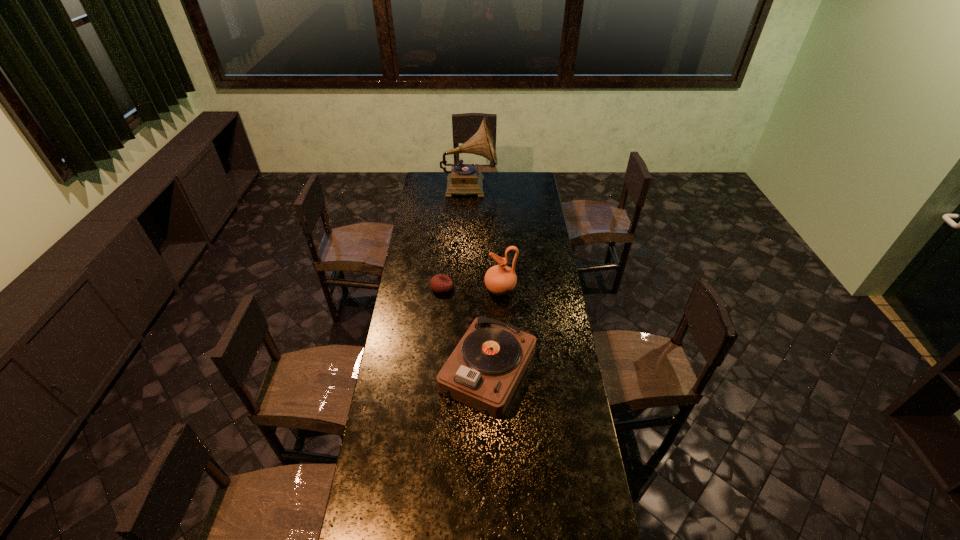
Where is `vacant space located 0.160m on the front of the nearest object`? The width and height of the screenshot is (960, 540). vacant space located 0.160m on the front of the nearest object is located at coordinates (490, 465).

You are a GUI agent. You are given a task and a screenshot of the screen. Output one action in this format:
    pyautogui.click(x=<x>, y=<y>)
    Task: Click on the vacant space situated 0.070m on the left of the shortest object
    
    Given the screenshot: What is the action you would take?
    pyautogui.click(x=417, y=288)

Where is `object located at the far edge`? The height and width of the screenshot is (540, 960). object located at the far edge is located at coordinates (464, 179).

At what (x,y) coordinates should I click in order to perform the action: click on record player located at the left edge. Please return your answer as a coordinate pair (x, y). This screenshot has width=960, height=540. Looking at the image, I should click on (464, 179).

This screenshot has height=540, width=960. Find the location of `beanbag located at the left edge`. beanbag located at the left edge is located at coordinates (440, 283).

Where is `object positioned at the right edge`? This screenshot has height=540, width=960. object positioned at the right edge is located at coordinates (484, 370).

You are a GUI agent. You are given a task and a screenshot of the screen. Output one action in this format:
    pyautogui.click(x=<x>, y=<y>)
    Task: Click on the object located at the far left corner
    The image size is (960, 540).
    Given the screenshot: What is the action you would take?
    pyautogui.click(x=464, y=179)

The image size is (960, 540). What are the coordinates of `vacant space at the far edge` in the screenshot? It's located at (497, 180).

This screenshot has height=540, width=960. In order to click on vacant space at the left edge of the desktop in this screenshot , I will do `click(392, 471)`.

What are the coordinates of `vacant space at the right edge` in the screenshot? It's located at (540, 373).